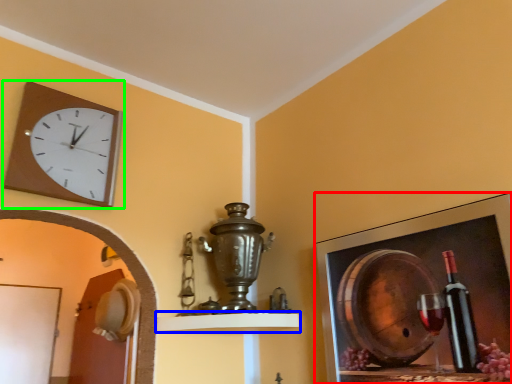
Question: Estimate the real-world distances between objects in this image. Which object is closer to picture frame (highlighted by a red box), shelf (highlighted by a blue box) or wall clock (highlighted by a green box)?

Choices:
 (A) shelf
 (B) wall clock

Answer: (A)